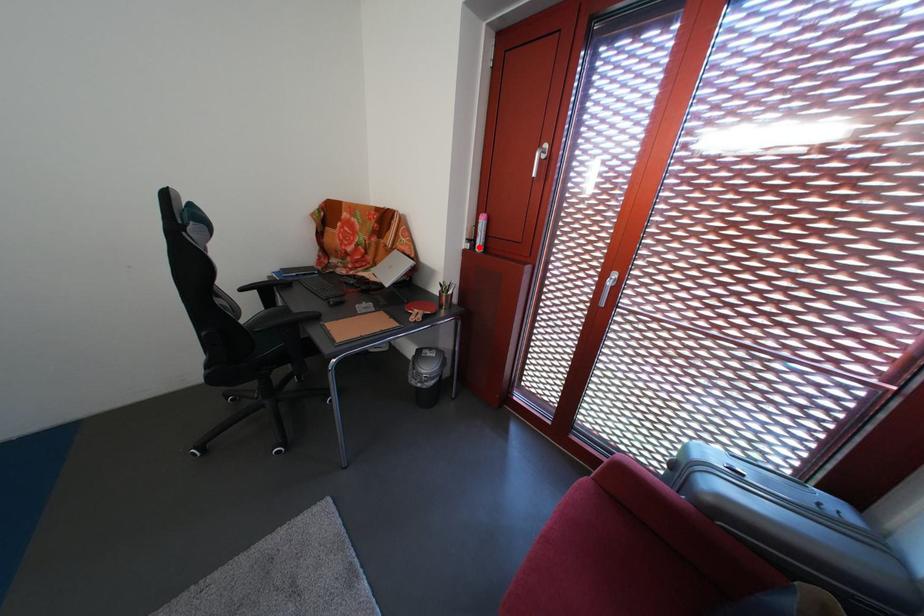
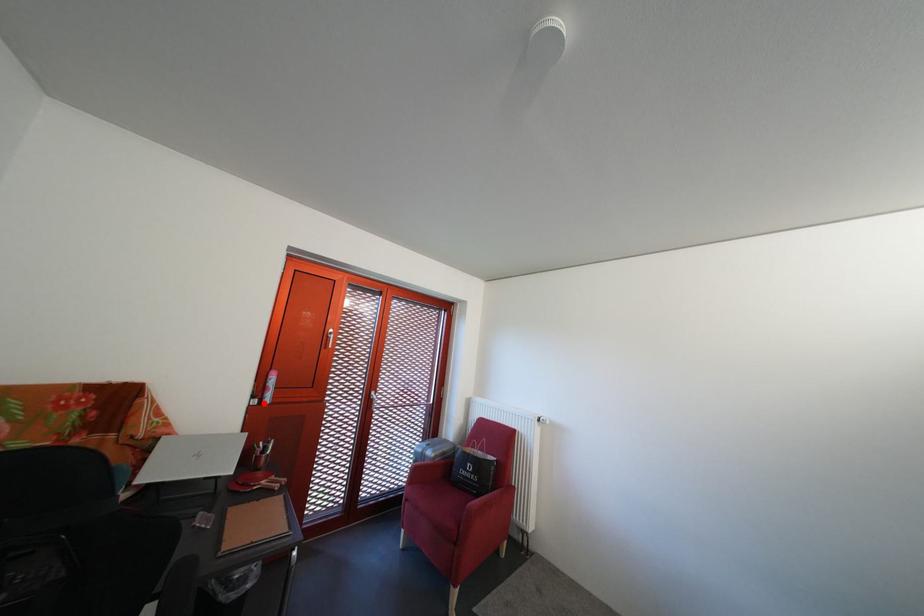
I am providing you with two images of the same scene from different viewpoints. A red point is marked on the first image and another point is marked on the second image. Does the point marked in image1 correspond to the same location as the one in image2?

Yes